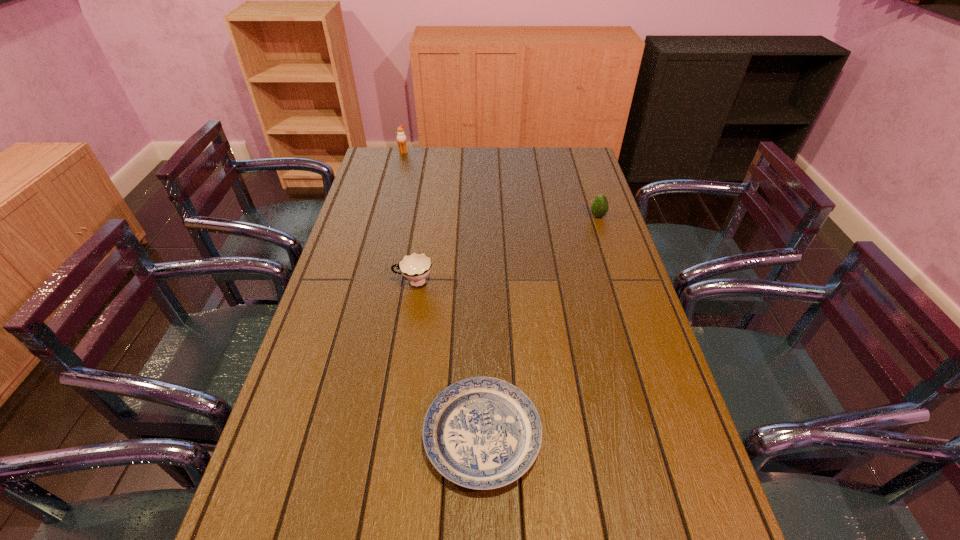
You are a GUI agent. You are given a task and a screenshot of the screen. Output one action in this format:
    pyautogui.click(x=<x>, y=<y>)
    Task: Click on the vacant space that's between the second object from right to left and the cup
    Image resolution: width=960 pixels, height=540 pixels.
    Given the screenshot: What is the action you would take?
    pyautogui.click(x=448, y=359)

I want to click on object that is the third closest to the third farthest object, so click(x=401, y=137).

You are a GUI agent. You are given a task and a screenshot of the screen. Output one action in this format:
    pyautogui.click(x=<x>, y=<y>)
    Task: Click on the object that stands as the third closest to the second object from right to left
    
    Given the screenshot: What is the action you would take?
    pyautogui.click(x=401, y=137)

You are a GUI agent. You are given a task and a screenshot of the screen. Output one action in this format:
    pyautogui.click(x=<x>, y=<y>)
    Task: Click on the vacant space that satisfies the following two spatial constraints: 1. at the front with a straw on the third object from left to right; 2. on the left side of the tallest object
    This screenshot has width=960, height=540.
    Given the screenshot: What is the action you would take?
    pyautogui.click(x=331, y=436)

This screenshot has width=960, height=540. I want to click on free location that satisfies the following two spatial constraints: 1. on the side of the cup with the handle; 2. at the front with a straw on the tallest object, so click(x=434, y=153).

At what (x,y) coordinates should I click in order to perform the action: click on vacant space that satisfies the following two spatial constraints: 1. on the side of the third farthest object with the handle; 2. at the front with a straw on the farthest object. Please return your answer as a coordinate pair (x, y). This screenshot has height=540, width=960. Looking at the image, I should click on (434, 153).

This screenshot has height=540, width=960. I want to click on vacant area that satisfies the following two spatial constraints: 1. on the side of the cup with the handle; 2. on the left side of the avocado, so click(423, 216).

Locate an element on the screen. This screenshot has width=960, height=540. free space that satisfies the following two spatial constraints: 1. at the front with a straw on the farthest object; 2. on the left side of the avocado is located at coordinates (387, 216).

Identify the location of free space that satisfies the following two spatial constraints: 1. at the front with a straw on the tallest object; 2. on the side of the cup with the handle. The image size is (960, 540). (371, 282).

Find the location of a particular element. The image size is (960, 540). vacant region that satisfies the following two spatial constraints: 1. at the front with a straw on the leftmost object; 2. on the right side of the nearest object is located at coordinates (331, 436).